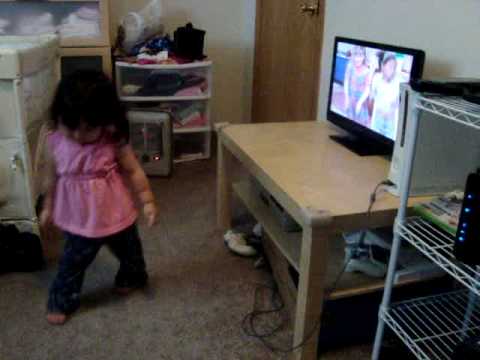
Where is `carpet`? Image resolution: width=480 pixels, height=360 pixels. carpet is located at coordinates (213, 307).